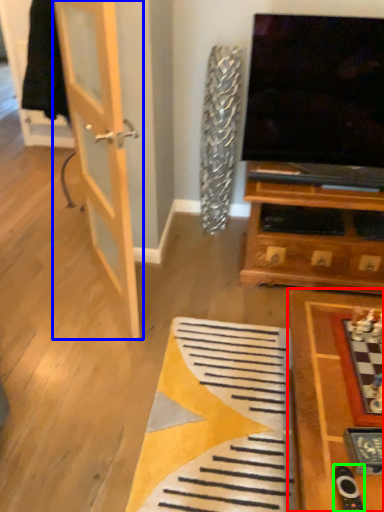
Question: Which object is the farthest from table (highlighted by a red box)? Choose among these: door (highlighted by a blue box) or remote (highlighted by a green box).

Choices:
 (A) door
 (B) remote

Answer: (A)